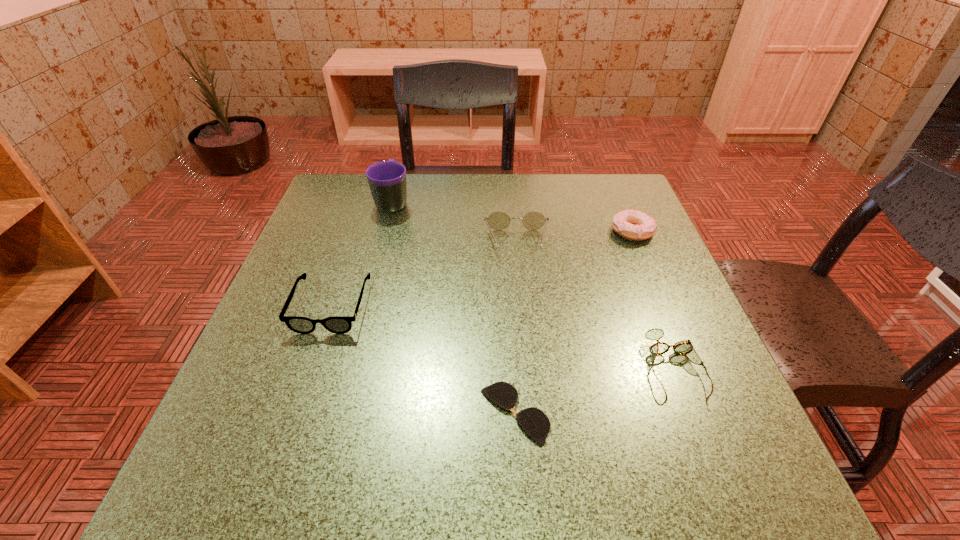
Select which spectacles is the third closest to the doughnut. Please provide its 2D coordinates. Your answer should be formatted as a tuple, i.e. [(x, y)], where the tuple contains the x and y coordinates of a point satisfying the conditions above.

[(536, 424)]

Point out which spectacles is positioned as the nearest to the farthest spectacles. Please provide its 2D coordinates. Your answer should be formatted as a tuple, i.e. [(x, y)], where the tuple contains the x and y coordinates of a point satisfying the conditions above.

[(337, 324)]